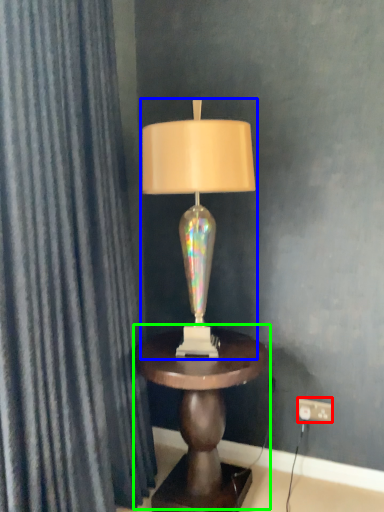
Question: Estimate the real-world distances between objects in this image. Which object is farther from electric outlet (highlighted by a red box), lamp (highlighted by a blue box) or table (highlighted by a green box)?

Choices:
 (A) lamp
 (B) table

Answer: (A)